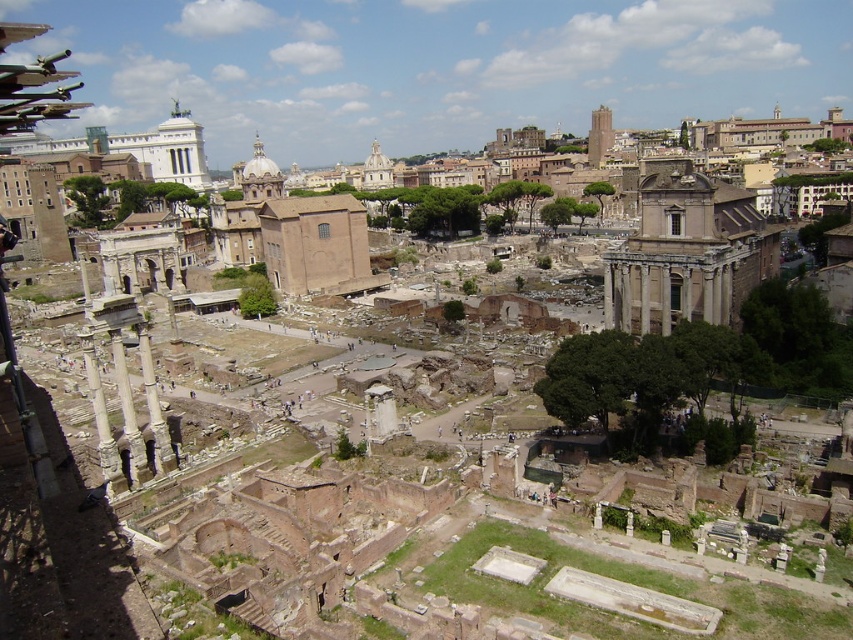
Is point (143, 449) closer to camera compared to point (163, 468)?

Yes, it is.

This screenshot has height=640, width=853. Describe the element at coordinates (128, 413) in the screenshot. I see `white marble pillar at center` at that location.

Is point (137, 456) positioned behind point (146, 355)?

No.

Find the location of a particular element. This screenshot has width=853, height=640. white marble pillar at center is located at coordinates click(x=128, y=413).

Is point (740, 300) closer to camera compared to point (117, 330)?

No.

Is point (672, 260) positioned behind point (123, 376)?

Yes, point (672, 260) is behind point (123, 376).

Where is `light brown stone columns at center right`? The image size is (853, 640). light brown stone columns at center right is located at coordinates (686, 252).

Who is lower down, light brown stone columns at center right or white marble pillar at lower left?

white marble pillar at lower left is lower down.

Between point (688, 312) and point (86, 372), which one is positioned in front?

Positioned in front is point (86, 372).

The image size is (853, 640). What do you see at coordinates (686, 252) in the screenshot?
I see `light brown stone columns at center right` at bounding box center [686, 252].

At what (x,y) coordinates should I click in order to perform the action: click on light brown stone columns at center right. Please return your answer as a coordinate pair (x, y). The width and height of the screenshot is (853, 640). Looking at the image, I should click on (686, 252).